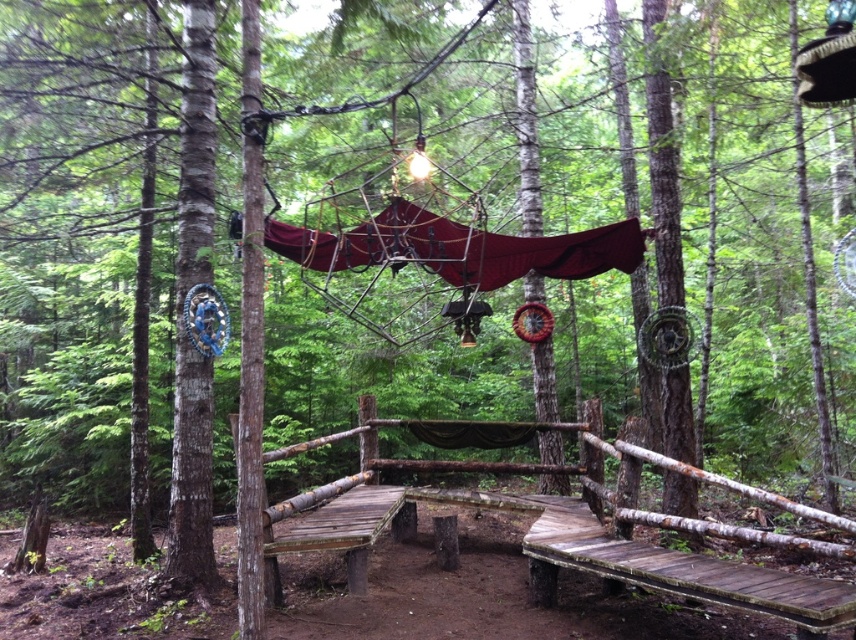
Question: Is burgundy fabric canopy at center thinner than wooden park bench at lower right?

Choices:
 (A) no
 (B) yes

Answer: (A)

Question: In this image, where is burgundy fabric canopy at center located relative to brown wood bench at center?

Choices:
 (A) right
 (B) left

Answer: (B)

Question: Which point appears closest to the camera in this image?

Choices:
 (A) (336, 499)
 (B) (533, 528)

Answer: (B)

Question: Among these objects, which one is nearest to the camera?

Choices:
 (A) burgundy fabric canopy at center
 (B) wooden park bench at lower right
 (C) weathered wood bench at center

Answer: (B)

Question: Considering the relative positions of burgundy fabric canopy at center and wooden park bench at lower right in the image provided, where is burgundy fabric canopy at center located with respect to wooden park bench at lower right?

Choices:
 (A) above
 (B) below

Answer: (A)

Question: Which object appears closest to the camera in this image?

Choices:
 (A) burgundy fabric canopy at center
 (B) brown wood bench at center
 (C) wooden park bench at lower right
 (D) weathered wood bench at center

Answer: (C)